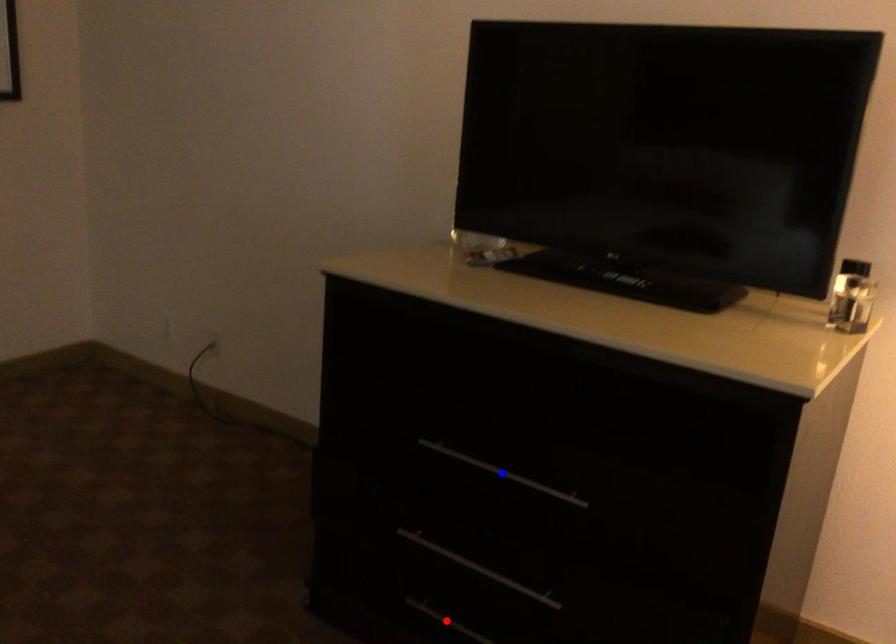
Question: Two points are marked on the image. Which point is closer to the camera?

Choices:
 (A) Blue point is closer.
 (B) Red point is closer.

Answer: (A)